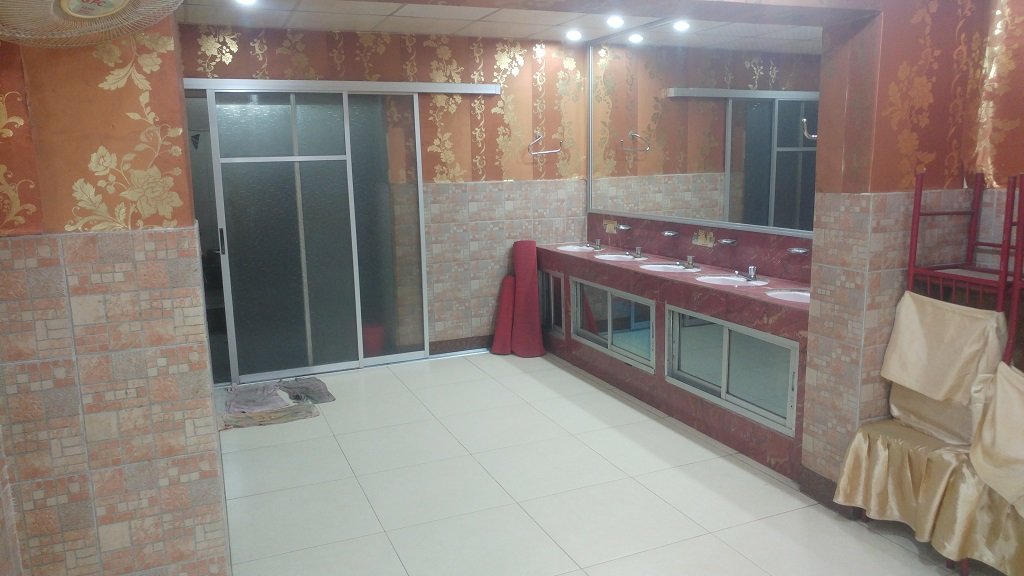
Find the location of `door handle`. door handle is located at coordinates (220, 234).